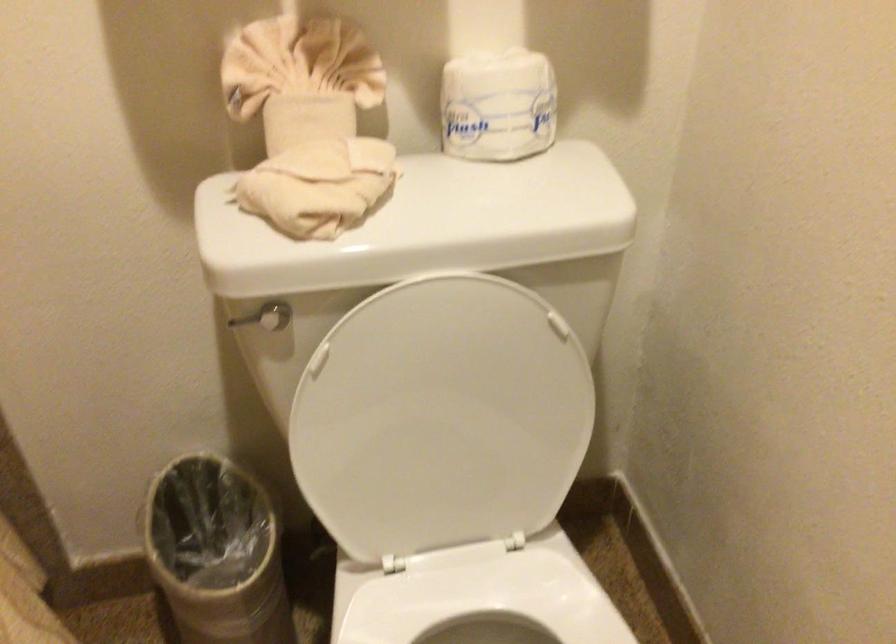
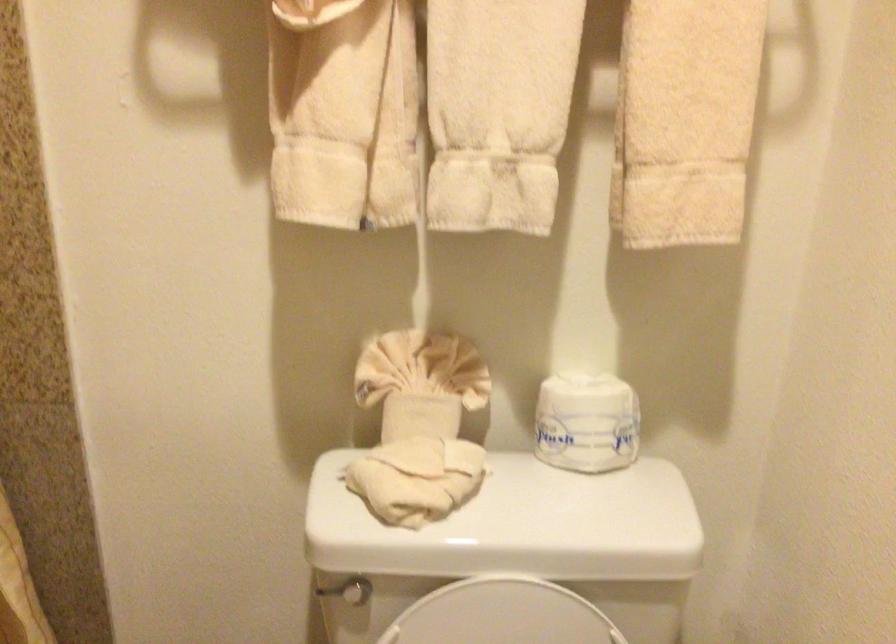
The point at (498, 102) is marked in the first image. Where is the corresponding point in the second image?

(587, 422)